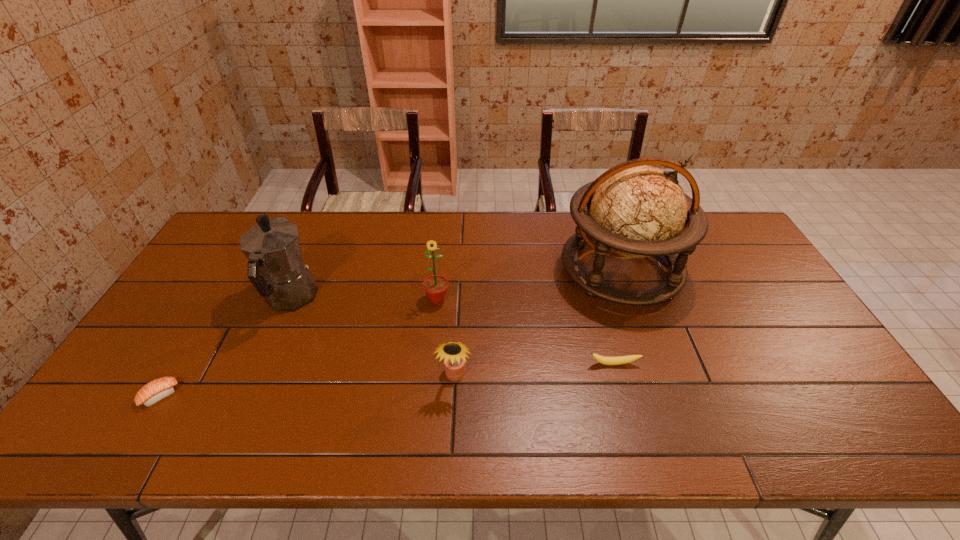
Identify the location of empty space between the shortest object and the globe. The height and width of the screenshot is (540, 960). (391, 332).

The height and width of the screenshot is (540, 960). I want to click on free space between the fourth tallest object and the second object from left to right, so click(372, 337).

Where is `vacant region between the tallest object and the third tallest object`? vacant region between the tallest object and the third tallest object is located at coordinates (529, 284).

Where is `free spot between the fifth shortest object and the leftmost object`? free spot between the fifth shortest object and the leftmost object is located at coordinates (225, 347).

Where is `free space between the fifth tallest object and the second object from left to right`? free space between the fifth tallest object and the second object from left to right is located at coordinates (452, 331).

Identify which object is located as the second nearest to the globe. Please provide its 2D coordinates. Your answer should be formatted as a tuple, i.e. [(x, y)], where the tuple contains the x and y coordinates of a point satisfying the conditions above.

[(454, 353)]

At what (x,y) coordinates should I click in order to perform the action: click on object identified as the fourth closest to the taller sunflower. Please return your answer as a coordinate pair (x, y). Looking at the image, I should click on (604, 360).